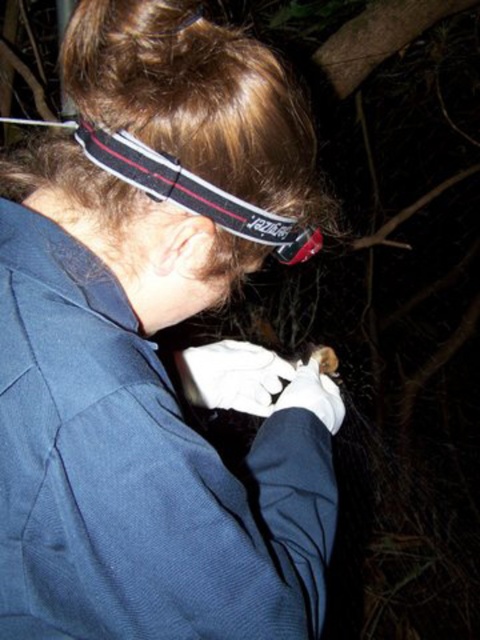
You are a researcher preparing to take measurements in a dark forest. You notice a point at coordinates (x=193, y=193) on your camera screen. What object is located at that point?

The point at coordinates (x=193, y=193) corresponds to the black fabric headband at upper center.

You are a researcher preparing to document an animal encounter. You have a dark blue fabric at center and a white cotton glove at center in your field of view. Which item is positioned higher in your view?

The dark blue fabric at center is taller than the white cotton glove at center, so the dark blue fabric at center is positioned higher in your view.

You are a photographer aiming to capture a clear image of the dark blue fabric at center. Considering the distance, can you estimate if you need to adjust your camera focus to ensure sharpness?

The dark blue fabric at center is 19.07 inches from viewer. Since this distance is within typical camera focus ranges, no adjustment is needed for sharpness.